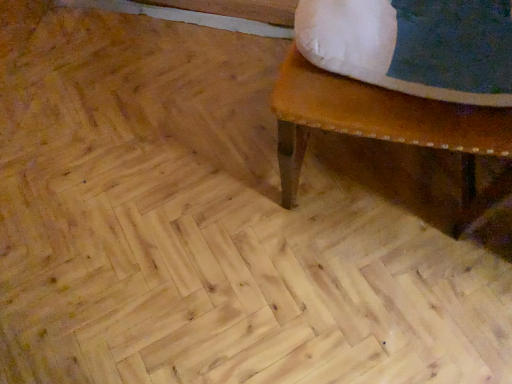
The height and width of the screenshot is (384, 512). What are the coordinates of `free space in front of brown wooden bench at upper right` in the screenshot? It's located at (389, 301).